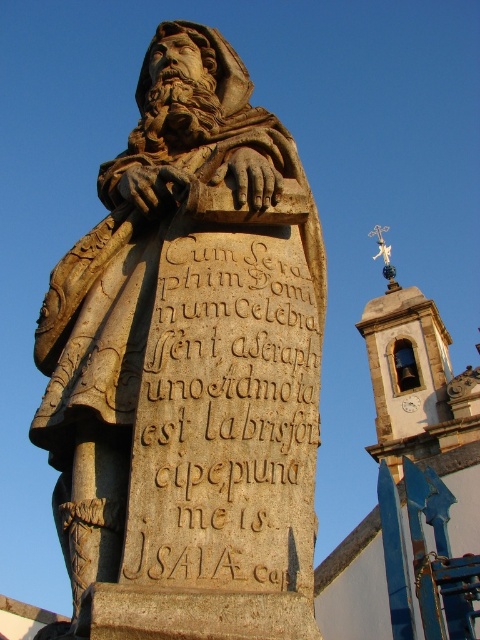
Can you confirm if stone statue at center is positioned above brown stone inscription at center?

Yes.

At what (x,y) coordinates should I click in order to perform the action: click on stone statue at center. Please return your answer as a coordinate pair (x, y). Looking at the image, I should click on click(x=190, y=368).

Where is `stone statue at center`? stone statue at center is located at coordinates (190, 368).

Identify the location of stone statue at center. (190, 368).